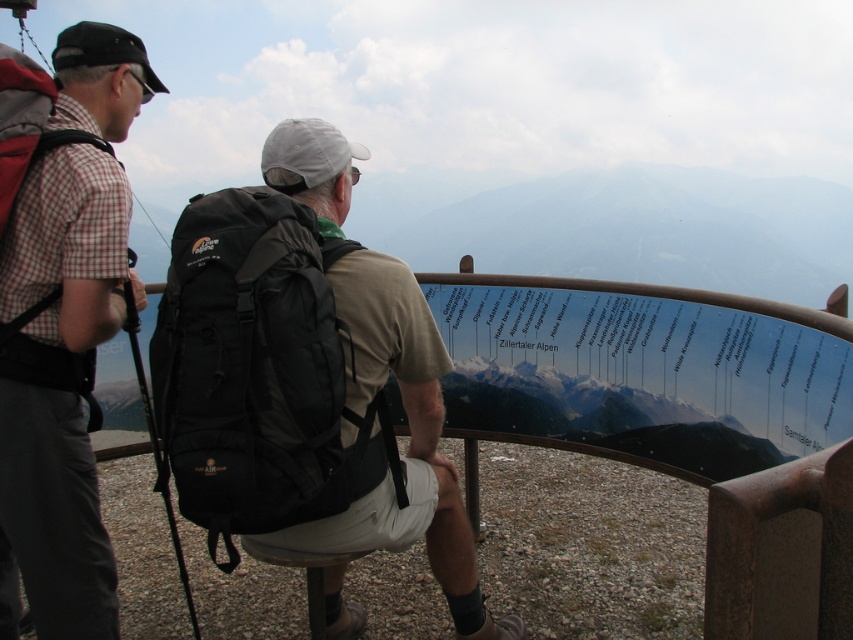
Is point (325, 320) closer to viewer compared to point (442, 404)?

Yes.

Who is more distant from viewer, (392, 429) or (387, 273)?

Positioned behind is point (392, 429).

You are a GUI agent. You are given a task and a screenshot of the screen. Output one action in this format:
    pyautogui.click(x=<x>, y=<y>)
    Task: Click on the black fabric backpack at center
    This screenshot has width=853, height=640.
    Given the screenshot: What is the action you would take?
    pyautogui.click(x=257, y=372)

Can you confirm if black fabric backpack at center is wider than matte plaid shirt at left?

Yes, black fabric backpack at center is wider than matte plaid shirt at left.

This screenshot has width=853, height=640. I want to click on black fabric backpack at center, so click(257, 372).

Is point (73, 556) more distant than point (379, 515)?

Yes, it is.

The image size is (853, 640). Find the location of `matte plaid shirt at left`. matte plaid shirt at left is located at coordinates (65, 337).